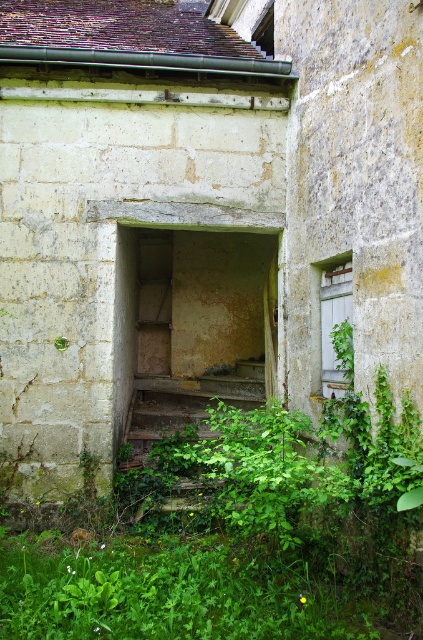
Is green leafy plant at lower center wider than wooden rustic stairs at center?

Yes, green leafy plant at lower center is wider than wooden rustic stairs at center.

Which is behind, point (271, 529) or point (151, 438)?

Point (151, 438)

This screenshot has height=640, width=423. Find the location of `green leafy plant at lower center`. green leafy plant at lower center is located at coordinates click(233, 532).